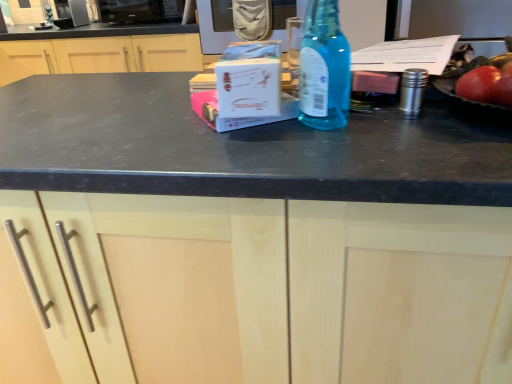
Locate an element on the screen. vacant space in front of blue glass bottle at center is located at coordinates (341, 158).